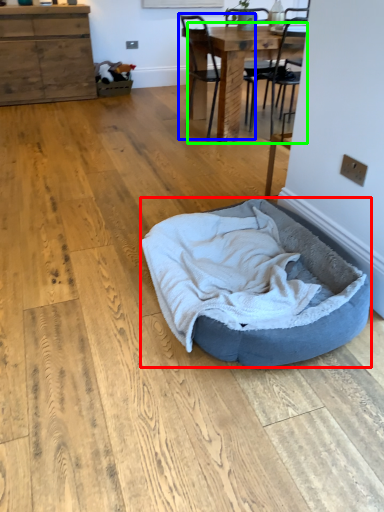
Question: Based on their relative distances, which object is farther from dog bed (highlighted by a red box)? Choose from chair (highlighted by a blue box) and table (highlighted by a green box).

Choices:
 (A) chair
 (B) table

Answer: (A)